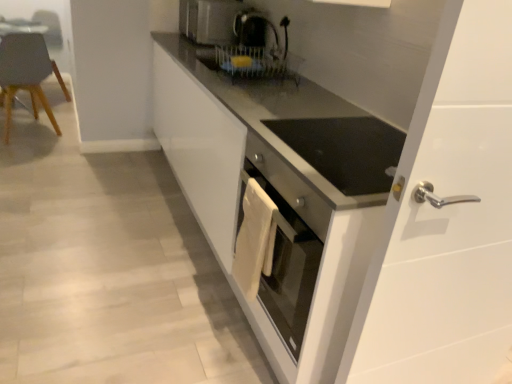
What are the coordinates of `empty space that is to the right of matte gray chair at left` in the screenshot? It's located at (64, 144).